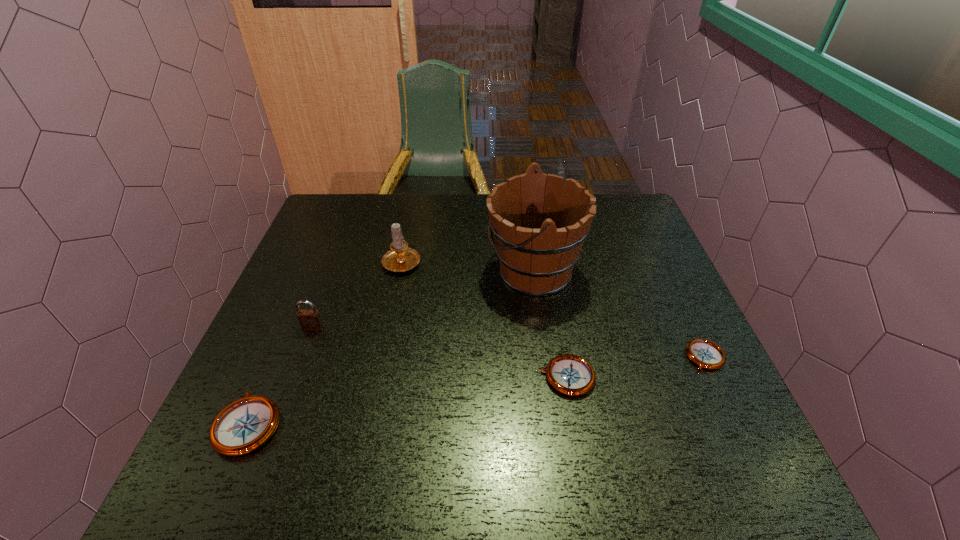
Locate an element on the screen. Image resolution: width=960 pixels, height=540 pixels. object that is the second closest to the fifth shortest object is located at coordinates (310, 320).

Locate an element on the screen. The image size is (960, 540). compass identified as the closest to the second compass from right to left is located at coordinates (706, 354).

Locate which compass is the second closest to the tallest object. Please provide its 2D coordinates. Your answer should be formatted as a tuple, i.e. [(x, y)], where the tuple contains the x and y coordinates of a point satisfying the conditions above.

[(706, 354)]

The width and height of the screenshot is (960, 540). I want to click on vacant area that satisfies the following two spatial constraints: 1. with the handle on the wine bucket; 2. on the front-facing side of the third tallest object, so click(541, 328).

Locate an element on the screen. The width and height of the screenshot is (960, 540). vacant point that satisfies the following two spatial constraints: 1. with the handle on the shortest object; 2. on the right side of the tallest object is located at coordinates (545, 357).

In order to click on blank space that satisfies the following two spatial constraints: 1. on the front-facing side of the rightmost compass; 2. on the left side of the padlock in this screenshot , I will do `click(302, 357)`.